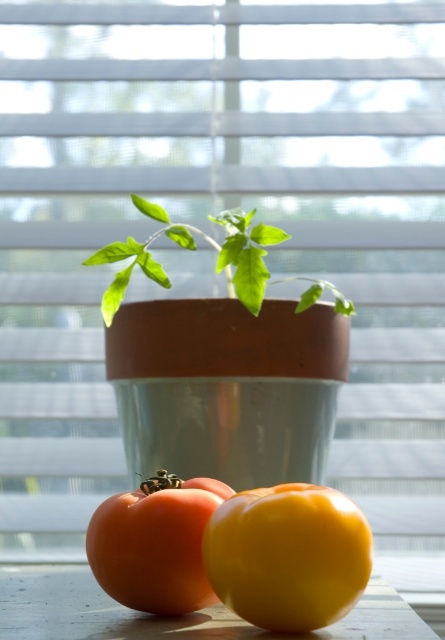
You are a gardener who wants to plant a new seedling in the garden. The seedling requires a minimum of 12 inches of space between it and the nearest plant to thrive. You see the yellow matte bell pepper at lower center and the green matte plant at center. Can the seedling be placed between them without violating the spacing requirement?

The yellow matte bell pepper at lower center is 12.49 inches from the green matte plant at center. Since the required minimum spacing is 12 inches, the seedling can be placed between them as the distance meets the requirement.

You are a gardener who wants to water the green matte plant at center without splashing the shiny red tomato at lower left. Can you reach the plant with a watering can that has a 25 cm long handle?

The shiny red tomato at lower left is 27.01 centimeters from the green matte plant at center. Since the watering can handle is 25 cm long, it is shorter than the distance between them. Therefore, you cannot safely water the plant without possibly splashing the tomato.